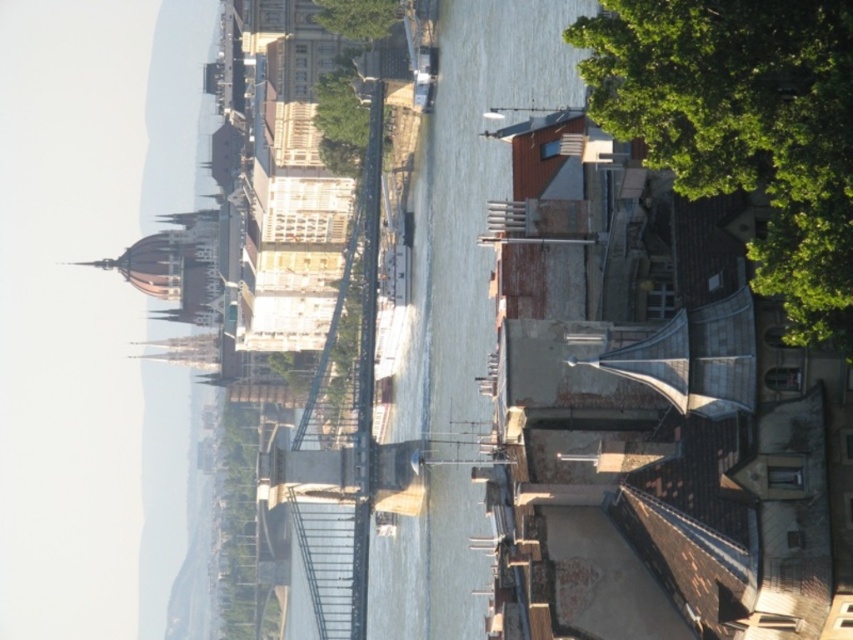
Question: Does clear water at center have a lesser width compared to green leafy tree at upper center?

Choices:
 (A) yes
 (B) no

Answer: (B)

Question: Does green leafy tree at upper right come in front of green leafy tree at upper center?

Choices:
 (A) yes
 (B) no

Answer: (A)

Question: Among these objects, which one is farthest from the camera?

Choices:
 (A) clear water at center
 (B) green leafy tree at upper center

Answer: (A)

Question: Is green leafy tree at upper right below green leafy tree at upper center?

Choices:
 (A) no
 (B) yes

Answer: (B)

Question: Which of the following is the closest to the observer?

Choices:
 (A) green leafy tree at upper right
 (B) clear water at center
 (C) green leafy tree at upper center

Answer: (A)

Question: Estimate the real-world distances between objects in this image. Which object is closer to the green leafy tree at upper center?

Choices:
 (A) clear water at center
 (B) green leafy tree at upper right

Answer: (B)